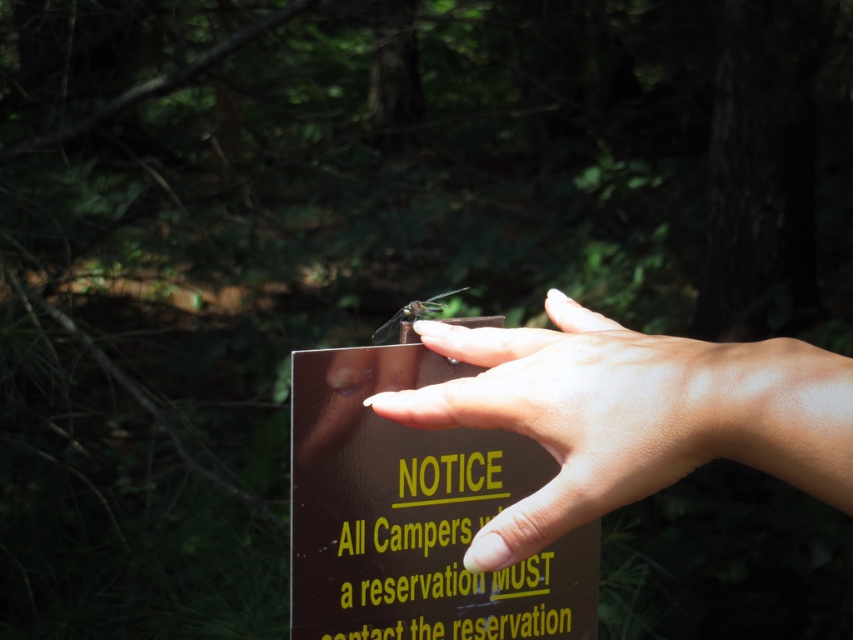
Question: Which of these objects is positioned closest to the brown glossy sign at center?

Choices:
 (A) smooth brown hand at center
 (B) translucent brown dragonfly at center

Answer: (B)

Question: Which object is farther from the camera taking this photo?

Choices:
 (A) translucent brown dragonfly at center
 (B) brown glossy sign at center

Answer: (A)

Question: Is smooth brown hand at center below translucent brown dragonfly at center?

Choices:
 (A) yes
 (B) no

Answer: (A)

Question: Which point is farther from the camera taking this photo?

Choices:
 (A) (737, 381)
 (B) (445, 294)

Answer: (B)

Question: Is brown glossy sign at center to the left of smooth brown hand at center from the viewer's perspective?

Choices:
 (A) no
 (B) yes

Answer: (B)

Question: Does brown glossy sign at center appear on the left side of smooth brown hand at center?

Choices:
 (A) no
 (B) yes

Answer: (B)